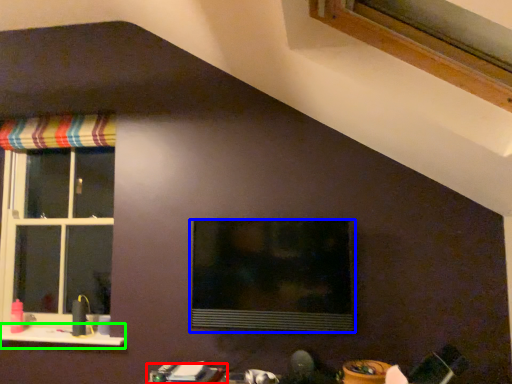
Question: Based on their relative distances, which object is nearer to table (highlighted by a red box)? Choose from window (highlighted by a blue box) and window sill (highlighted by a green box).

Choices:
 (A) window
 (B) window sill

Answer: (A)